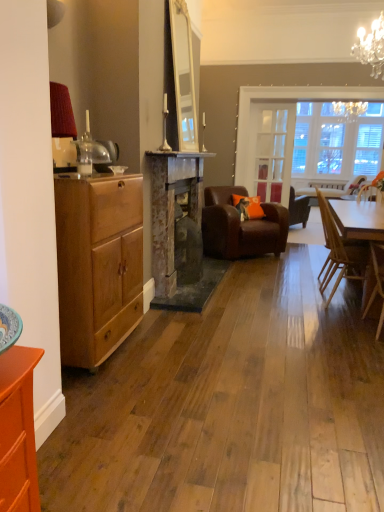
Question: Are light brown wooden chair at right, which is counted as the 4th chair, starting from the back, and matte wood chest of drawers at left making contact?

Choices:
 (A) no
 (B) yes

Answer: (A)

Question: Does light brown wooden chair at right, which is counted as the 4th chair, starting from the back, have a greater width compared to matte wood chest of drawers at left?

Choices:
 (A) no
 (B) yes

Answer: (B)

Question: Could you tell me if light brown wooden chair at right, which is counted as the 4th chair, starting from the back, is facing matte wood chest of drawers at left?

Choices:
 (A) yes
 (B) no

Answer: (B)

Question: Does light brown wooden chair at right, which is counted as the 4th chair, starting from the back, have a smaller size compared to matte wood chest of drawers at left?

Choices:
 (A) no
 (B) yes

Answer: (B)

Question: Considering the positions of matte wood chest of drawers at left and brown leather armchair at center, which ranks as the 4th chair in front-to-back order, in the image, is matte wood chest of drawers at left bigger or smaller than brown leather armchair at center, which ranks as the 4th chair in front-to-back order,?

Choices:
 (A) big
 (B) small

Answer: (B)

Question: In terms of height, does matte wood chest of drawers at left look taller or shorter compared to brown leather armchair at center, the first chair in the back-to-front sequence?

Choices:
 (A) short
 (B) tall

Answer: (B)

Question: Choose the correct answer: Is matte wood chest of drawers at left inside brown leather armchair at center, the first chair in the back-to-front sequence, or outside it?

Choices:
 (A) outside
 (B) inside

Answer: (A)

Question: Does point (64, 356) appear closer or farther from the camera than point (289, 219)?

Choices:
 (A) closer
 (B) farther

Answer: (A)

Question: In terms of height, does rustic stone fireplace at center look taller or shorter compared to brown leather armchair at center, the 3th chair from the front?

Choices:
 (A) tall
 (B) short

Answer: (A)

Question: Considering the positions of rustic stone fireplace at center and brown leather armchair at center, which ranks as the 2th chair in back-to-front order, in the image, is rustic stone fireplace at center wider or thinner than brown leather armchair at center, which ranks as the 2th chair in back-to-front order,?

Choices:
 (A) thin
 (B) wide

Answer: (A)

Question: From the image's perspective, is rustic stone fireplace at center above or below brown leather armchair at center, which ranks as the 2th chair in back-to-front order?

Choices:
 (A) above
 (B) below

Answer: (B)

Question: In the image, is rustic stone fireplace at center on the left side or the right side of brown leather armchair at center, the 3th chair from the front?

Choices:
 (A) right
 (B) left

Answer: (B)

Question: Considering the positions of light brown wooden chair at right, arranged as the 1th chair when viewed from the front, and clear glass door at center in the image, is light brown wooden chair at right, arranged as the 1th chair when viewed from the front, bigger or smaller than clear glass door at center?

Choices:
 (A) big
 (B) small

Answer: (A)

Question: From a real-world perspective, is light brown wooden chair at right, arranged as the 1th chair when viewed from the front, positioned above or below clear glass door at center?

Choices:
 (A) above
 (B) below

Answer: (B)